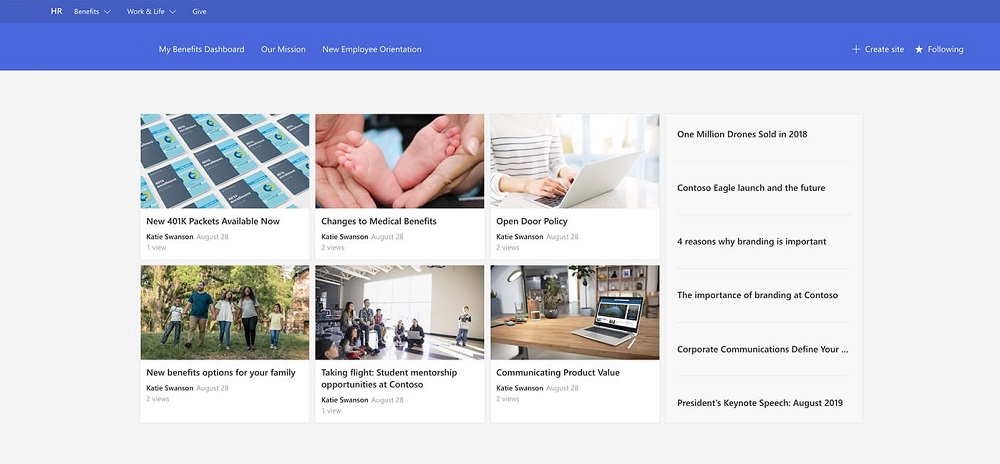
Where is `photos`? photos is located at coordinates (276, 164), (364, 166), (560, 151), (547, 301), (441, 290), (273, 300).